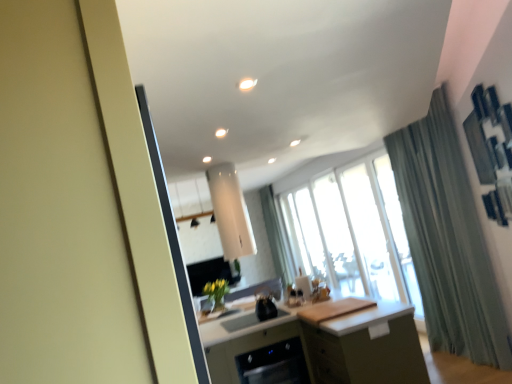
Measure the distance between point (x=448, y=246) and camera.

They are 4.07 meters apart.

Measure the distance between matte green cabinet at center and camera.

A distance of 2.98 meters exists between matte green cabinet at center and camera.

You are a GUI agent. You are given a task and a screenshot of the screen. Output one action in this format:
    pyautogui.click(x=<x>, y=<y>)
    Task: Click on the matte white screen door at left
    Image resolution: width=512 pixels, height=384 pixels.
    Given the screenshot: What is the action you would take?
    pyautogui.click(x=60, y=212)

Locate an element on the screen. This screenshot has width=512, height=384. black glossy dishwasher at lower center is located at coordinates (274, 364).

In order to click on white glossy light at upper center in this screenshot , I will do `click(247, 84)`.

Considering the sizes of objects black glossy dishwasher at lower center and matte white screen door at left in the image provided, who is shorter, black glossy dishwasher at lower center or matte white screen door at left?

black glossy dishwasher at lower center.

Are black glossy dishwasher at lower center and matte white screen door at left located far from each other?

Indeed, black glossy dishwasher at lower center is not near matte white screen door at left.

Does black glossy dishwasher at lower center turn towards matte white screen door at left?

No, black glossy dishwasher at lower center is not turned towards matte white screen door at left.

Is green fabric curtain at right in front of or behind black glossy dishwasher at lower center in the image?

In the image, green fabric curtain at right appears behind black glossy dishwasher at lower center.

Which of these two, green fabric curtain at right or black glossy dishwasher at lower center, stands shorter?

With less height is black glossy dishwasher at lower center.

From a real-world perspective, which object stands above the other?

In real-world perspective, green fabric curtain at right is above.

Does green fabric curtain at right contain black glossy dishwasher at lower center?

That's incorrect, black glossy dishwasher at lower center is not inside green fabric curtain at right.

Is matte green cabinet at center looking in the opposite direction of transparent glass window at center?

matte green cabinet at center is not turned away from transparent glass window at center.

From the image's perspective, between matte green cabinet at center and transparent glass window at center, which one is located above?

transparent glass window at center is shown above in the image.

Considering the relative positions of matte green cabinet at center and transparent glass window at center in the image provided, is matte green cabinet at center in front of transparent glass window at center?

Yes, matte green cabinet at center is closer to the camera.

Considering the relative positions of matte green cabinet at center and transparent glass window at center in the image provided, is matte green cabinet at center to the right of transparent glass window at center from the viewer's perspective?

No, matte green cabinet at center is not to the right of transparent glass window at center.

From the image's perspective, which is above, black glossy dishwasher at lower center or white glossy light at upper center?

From the image's view, white glossy light at upper center is above.

Image resolution: width=512 pixels, height=384 pixels. Identify the location of dish washer that is under the white glossy light at upper center (from a real-world perspective). (274, 364).

Considering the relative sizes of black glossy dishwasher at lower center and white glossy light at upper center in the image provided, is black glossy dishwasher at lower center taller than white glossy light at upper center?

Yes, black glossy dishwasher at lower center is taller than white glossy light at upper center.

Is black glossy dishwasher at lower center with white glossy light at upper center?

No, black glossy dishwasher at lower center is not with white glossy light at upper center.

Is transparent glass window at center wider than matte white screen door at left?

No.

Is transparent glass window at center taller or shorter than matte white screen door at left?

Clearly, transparent glass window at center is taller compared to matte white screen door at left.

Does point (387, 287) lie behind point (64, 108)?

Yes, point (387, 287) is behind point (64, 108).

Would you say white glossy light at upper center is inside or outside matte green cabinet at center?

white glossy light at upper center is located beyond the bounds of matte green cabinet at center.

Is white glossy light at upper center positioned with its back to matte green cabinet at center?

No, white glossy light at upper center is not facing the opposite direction of matte green cabinet at center.

From the image's perspective, is matte white screen door at left positioned above or below white glossy light at upper center?

From the image's perspective, matte white screen door at left appears below white glossy light at upper center.

Is matte white screen door at left positioned far away from white glossy light at upper center?

Indeed, matte white screen door at left is not near white glossy light at upper center.

The image size is (512, 384). Find the location of `screen door above the black glossy dishwasher at lower center (from the image's perspective)`. screen door above the black glossy dishwasher at lower center (from the image's perspective) is located at coordinates (60, 212).

Image resolution: width=512 pixels, height=384 pixels. Identify the location of curtain that appears above the black glossy dishwasher at lower center (from a real-world perspective). (448, 240).

When comparing their distances from matte green cabinet at center, does white glossy light at upper center or green fabric curtain at right seem further?

white glossy light at upper center lies further to matte green cabinet at center than the other object.

Estimate the real-world distances between objects in this image. Which object is closer to matte green cabinet at center, white glossy light at upper center or matte white screen door at left?

The object closer to matte green cabinet at center is white glossy light at upper center.

Considering their positions, is green fabric curtain at right positioned closer to white glossy light at upper center than matte white screen door at left?

matte white screen door at left lies closer to white glossy light at upper center than the other object.

Considering their positions, is matte green cabinet at center positioned further to green fabric curtain at right than black glossy dishwasher at lower center?

black glossy dishwasher at lower center.

From the image, which object appears to be farther from matte green cabinet at center, matte white screen door at left or transparent glass window at center?

matte white screen door at left.

Which object lies further to the anchor point matte white screen door at left, matte green cabinet at center or white glossy light at upper center?

Based on the image, matte green cabinet at center appears to be further to matte white screen door at left.

From the image, which object appears to be nearer to matte white screen door at left, transparent glass window at center or black glossy dishwasher at lower center?

black glossy dishwasher at lower center lies closer to matte white screen door at left than the other object.

When comparing their distances from matte white screen door at left, does green fabric curtain at right or matte green cabinet at center seem closer?

matte green cabinet at center lies closer to matte white screen door at left than the other object.

Where is `light positioned between matte white screen door at left and matte green cabinet at center from near to far`? The image size is (512, 384). light positioned between matte white screen door at left and matte green cabinet at center from near to far is located at coordinates (247, 84).

At what (x,y) coordinates should I click in order to perform the action: click on window between black glossy dishwasher at lower center and green fabric curtain at right in the horizontal direction. Please return your answer as a coordinate pair (x, y). Looking at the image, I should click on (353, 231).

Locate an element on the screen. light between matte white screen door at left and black glossy dishwasher at lower center in the front-back direction is located at coordinates (247, 84).

The image size is (512, 384). What are the coordinates of `cabinetry between matte white screen door at left and green fabric curtain at right from front to back` in the screenshot? It's located at (367, 347).